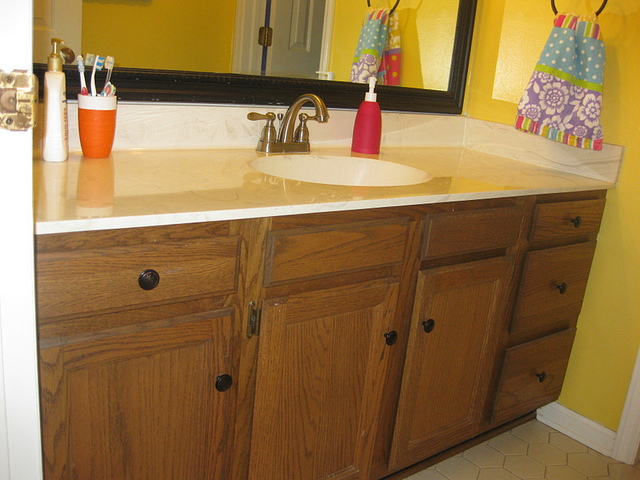
Image resolution: width=640 pixels, height=480 pixels. I want to click on bottle, so click(54, 122).